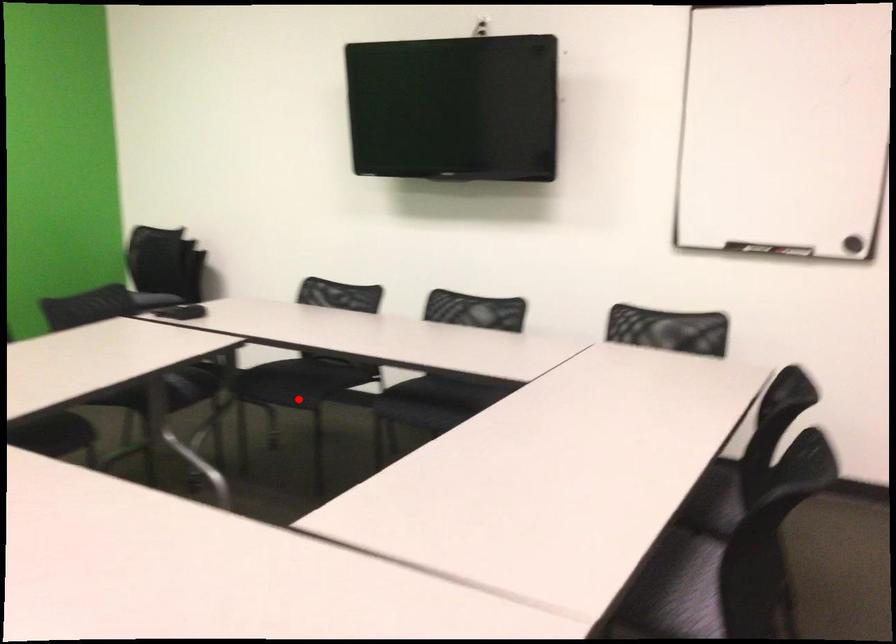
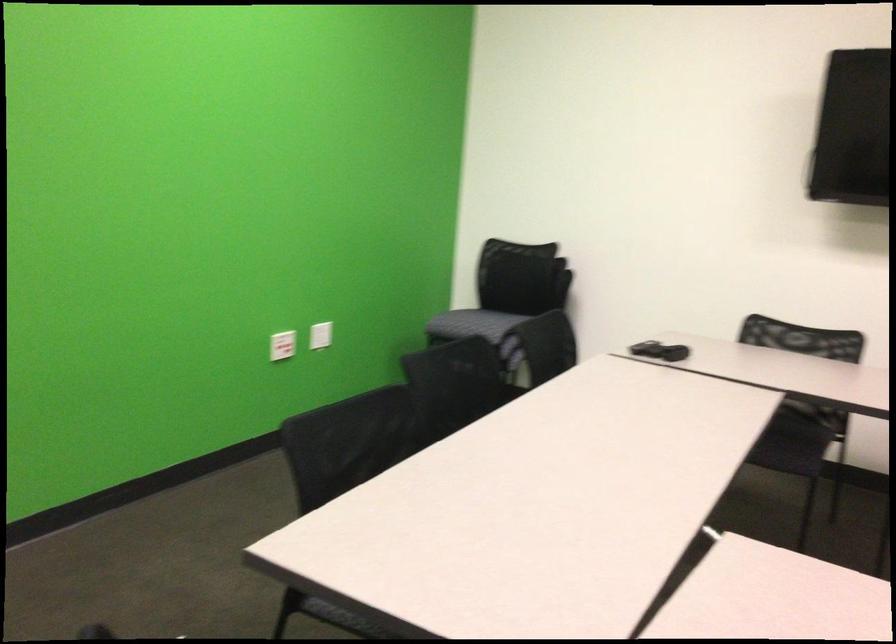
Find the pixel in the second image that matches the highlighted location in the first image.

(791, 444)